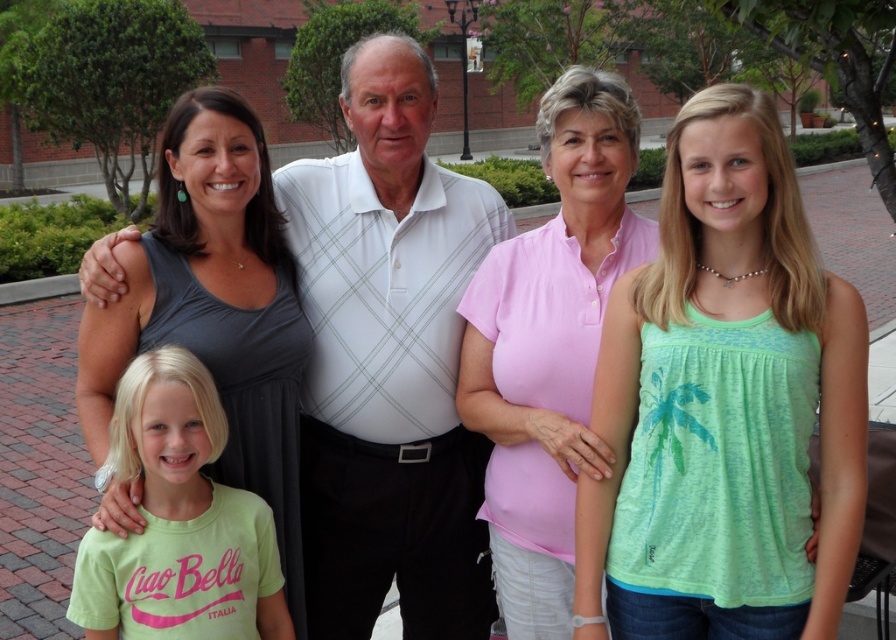
You are a photographer trying to capture a group photo of the gray matte tank top at left and the green cotton shirt at lower left. Which one is positioned to the right of the other?

The gray matte tank top at left is positioned on the right side of green cotton shirt at lower left.

You are a photographer trying to capture the group of people in the scene. You notice two specific points marked at coordinates point (669, 266) and point (160, 412). Which of these points is nearer to your camera lens?

Point (669, 266) is closer to the camera than point (160, 412).

You are a photographer trying to capture a group photo of the green fabric tank top at center and the green cotton shirt at lower left. Which person should you focus on first to ensure they are in the frame?

The green fabric tank top at center is much taller than the green cotton shirt at lower left, so you should focus on the green fabric tank top at center first to ensure they are in the frame.